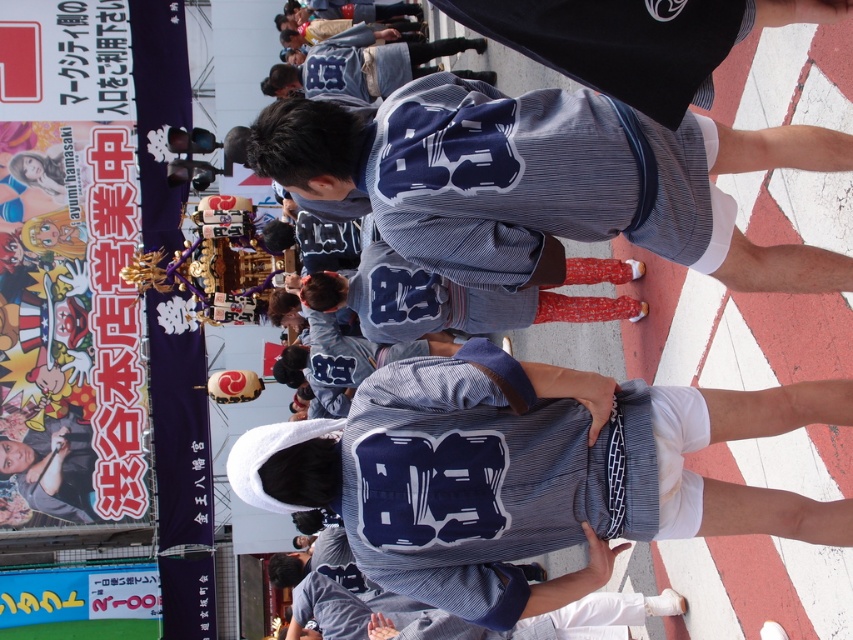
Is striped fabric shirt at center positioned behind striped fabric kimono at center?

Yes, striped fabric shirt at center is behind striped fabric kimono at center.

Where is `striped fabric shirt at center`? striped fabric shirt at center is located at coordinates (525, 474).